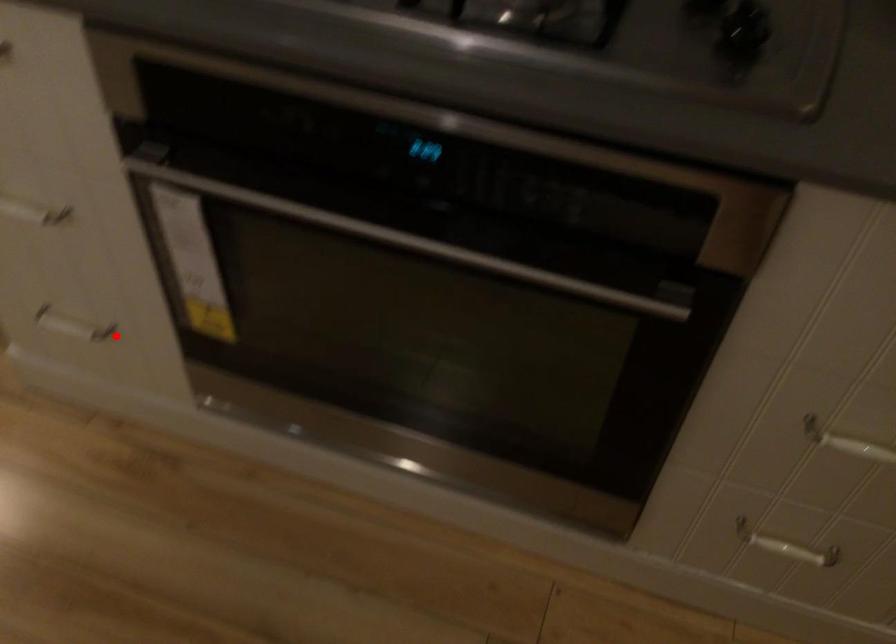
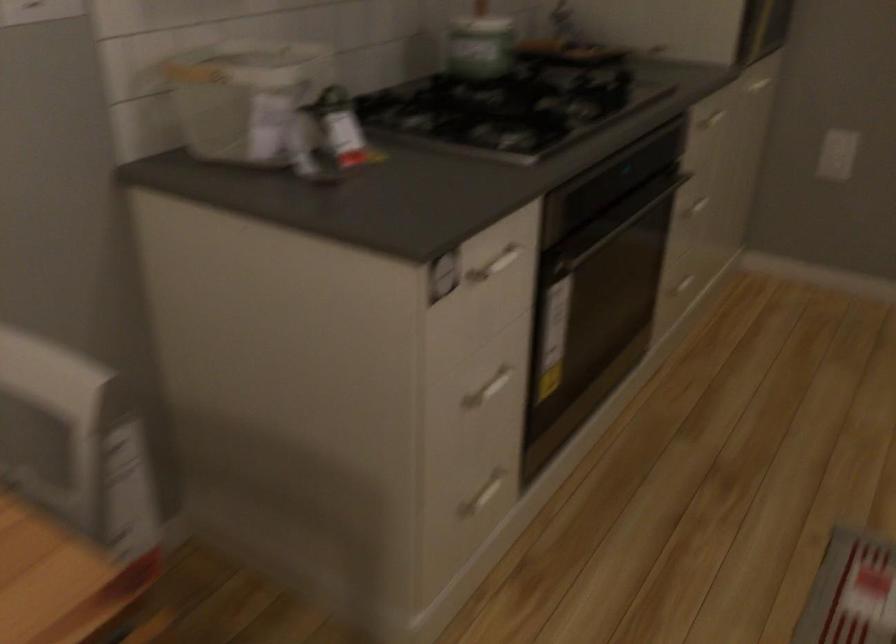
Where in the second image is the point corresponding to the highlighted location from the first image?

(484, 494)